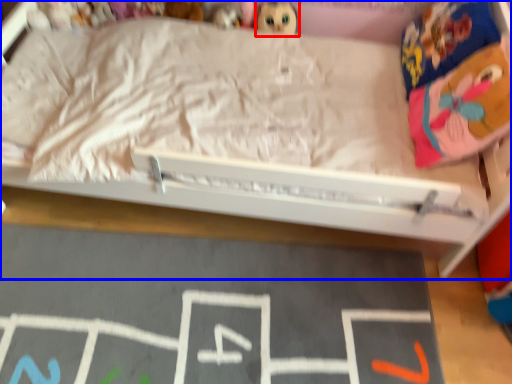
Question: Which point is further to the camera, toy (highlighted by a red box) or bed (highlighted by a blue box)?

Choices:
 (A) toy
 (B) bed

Answer: (A)